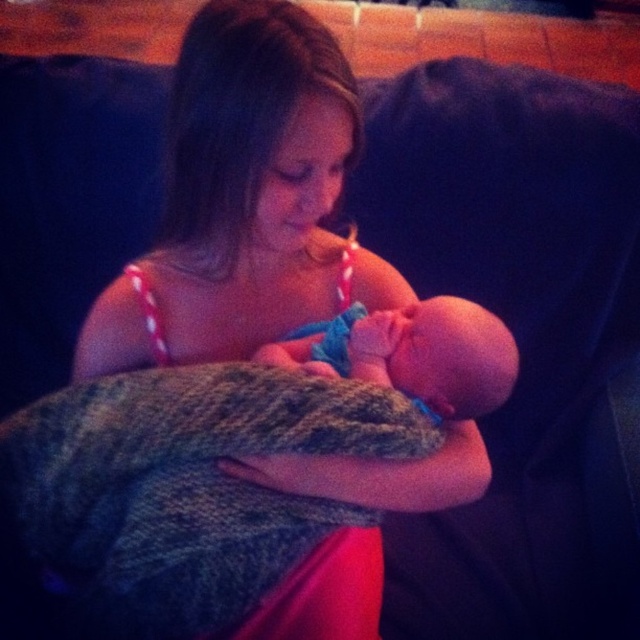
Question: Is matte pink dress at center wider than smooth skin newborn at center?

Choices:
 (A) yes
 (B) no

Answer: (A)

Question: Is matte pink dress at center to the right of smooth skin newborn at center from the viewer's perspective?

Choices:
 (A) yes
 (B) no

Answer: (B)

Question: Which point is closer to the camera?

Choices:
 (A) (248, 180)
 (B) (385, 378)

Answer: (A)

Question: Does matte pink dress at center have a smaller size compared to smooth skin newborn at center?

Choices:
 (A) no
 (B) yes

Answer: (A)

Question: Which object appears closest to the camera in this image?

Choices:
 (A) smooth skin newborn at center
 (B) matte pink dress at center

Answer: (B)